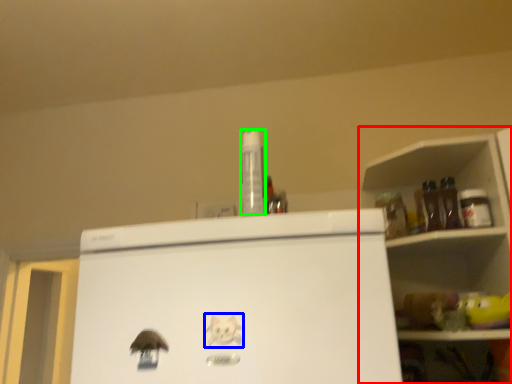
Question: Based on their relative distances, which object is nearer to shelf (highlighted by a red box)? Choose from animal (highlighted by a blue box) and bottle (highlighted by a green box).

Choices:
 (A) animal
 (B) bottle

Answer: (B)